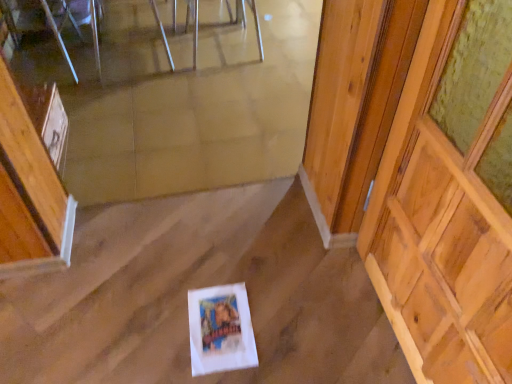
Question: In the image, is metallic silver chair at upper center, which is the second chair in right-to-left order, positioned in front of or behind metallic reflective chair at upper center, the first chair positioned from the right?

Choices:
 (A) behind
 (B) front

Answer: (B)

Question: Do you think metallic silver chair at upper center, which is the first chair from left to right, is within metallic reflective chair at upper center, which is the 2th chair in left-to-right order, or outside of it?

Choices:
 (A) inside
 (B) outside

Answer: (B)

Question: Which is nearer to the metallic silver chair at upper center, which is the first chair from left to right?

Choices:
 (A) metallic reflective chair at upper center, which is the 2th chair in left-to-right order
 (B) clear glass table at upper center
 (C) wooden at right

Answer: (B)

Question: Estimate the real-world distances between objects in this image. Which object is closer to the wooden at right?

Choices:
 (A) clear glass table at upper center
 (B) metallic silver chair at upper center, which is the second chair in right-to-left order
 (C) metallic reflective chair at upper center, the first chair positioned from the right

Answer: (C)